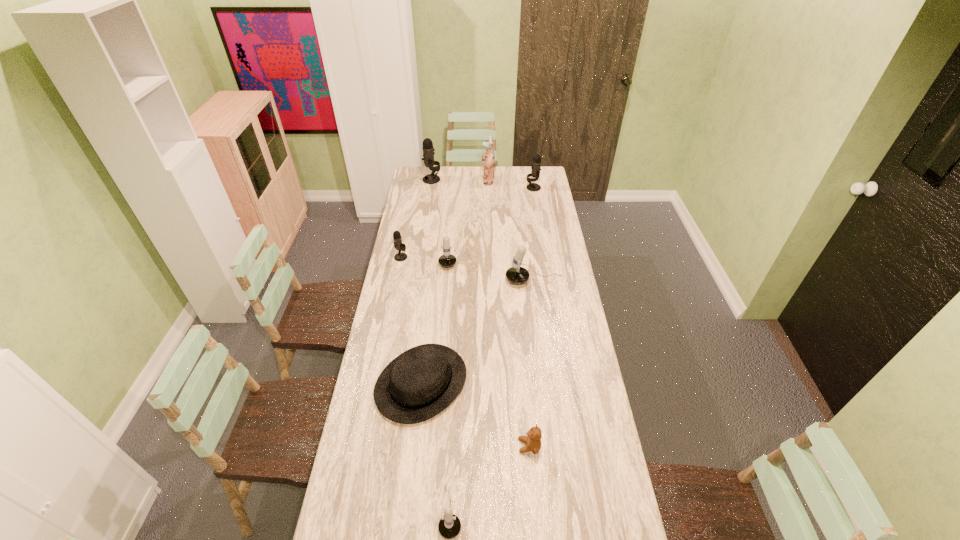
In the image, there is a desktop. Where is `blank space at the left edge`? blank space at the left edge is located at coordinates (415, 305).

Find the location of a particular element. This screenshot has width=960, height=540. vacant space at the right edge of the desktop is located at coordinates [x=564, y=302].

Locate an element on the screen. vacant region between the rightmost black microphone and the eighth farthest object is located at coordinates (531, 316).

Where is `vacant area that lies between the teddy bear and the second black microphone from right to left`? The height and width of the screenshot is (540, 960). vacant area that lies between the teddy bear and the second black microphone from right to left is located at coordinates (481, 313).

Identify the location of free area in between the second smallest black microphone and the second nearest white microphone. Image resolution: width=960 pixels, height=540 pixels. (534, 234).

At what (x,y) coordinates should I click in order to perform the action: click on vacant area that lies between the black fedora and the rightmost black microphone. Please return your answer as a coordinate pair (x, y). Image resolution: width=960 pixels, height=540 pixels. Looking at the image, I should click on (477, 285).

At what (x,y) coordinates should I click in order to perform the action: click on vacant area that lies between the farthest white microphone and the pink figurine. Please return your answer as a coordinate pair (x, y). The image size is (960, 540). Looking at the image, I should click on (468, 218).

The width and height of the screenshot is (960, 540). I want to click on vacant area that lies between the second biggest white microphone and the seventh farthest object, so click(435, 320).

This screenshot has width=960, height=540. I want to click on free space between the fifth farthest microphone and the black fedora, so click(478, 332).

Select which object appears as the eighth closest to the leftmost microphone. Please provide its 2D coordinates. Your answer should be formatted as a tuple, i.e. [(x, y)], where the tuple contains the x and y coordinates of a point satisfying the conditions above.

[(449, 526)]